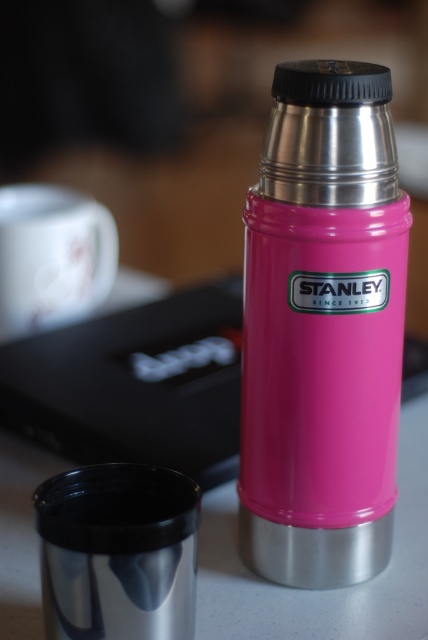
You are packing a lunchbox and need to place both the pink matte stanley thermos at center and the shiny metallic mug at center inside. The lunchbox has a compartment that can only fit items with a combined width of 14 inches. Can both items fit together in this compartment?

The pink matte stanley thermos at center and shiny metallic mug at center are 7.23 inches apart. However, the distance between them does not indicate their individual widths. Without knowing the individual widths of each item, it is impossible to determine if their combined width will fit within the 14 inch limit.

You are arranging mugs on a shelf and see the shiny metallic mug at center and the white glossy mug at upper left. Which mug should you move to the left side of the shelf to align them properly?

You should move the shiny metallic mug at center to the left side of the shelf because it is currently to the right of the white glossy mug at upper left, so moving it left would align them properly.

You are a delivery person who needs to place a new white glossy mug at upper left into a storage box located near the pink matte stanley thermos at center. Given the distance between them, can you estimate whether the mug will fit into the box if the box is 20 inches wide?

The distance between the pink matte stanley thermos at center and the white glossy mug at upper left is 21.05 inches. Since the box is only 20 inches wide, the mug may not fit comfortably within the box as the required space exceeds the box width.